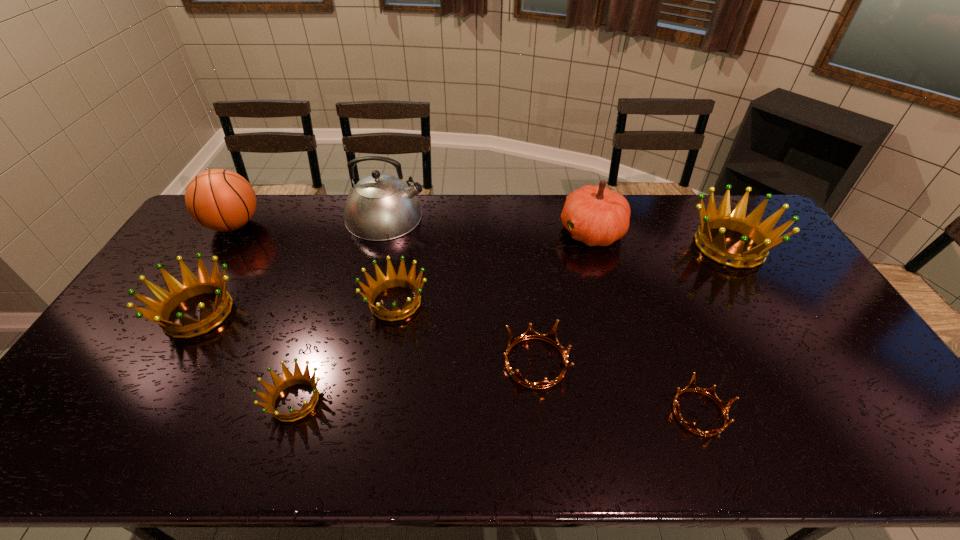
Where is `kettle`? kettle is located at coordinates (380, 207).

The width and height of the screenshot is (960, 540). In order to click on basketball in this screenshot , I will do `click(221, 200)`.

Locate an element on the screen. Image resolution: width=960 pixels, height=540 pixels. pink pumpkin is located at coordinates (595, 215).

I want to click on the tallest crown, so click(x=760, y=233).

This screenshot has height=540, width=960. I want to click on the rightmost object, so click(x=760, y=233).

Find the location of a particular element. the third smallest golden crown is located at coordinates (160, 310).

I want to click on the leftmost crown, so click(x=160, y=310).

Locate an element on the screen. This screenshot has width=960, height=540. the fourth shortest object is located at coordinates coord(392,279).

Find the location of `the third golden crown from left to right`. the third golden crown from left to right is located at coordinates (392, 279).

This screenshot has height=540, width=960. Find the location of `the left gold crown`. the left gold crown is located at coordinates (551, 337).